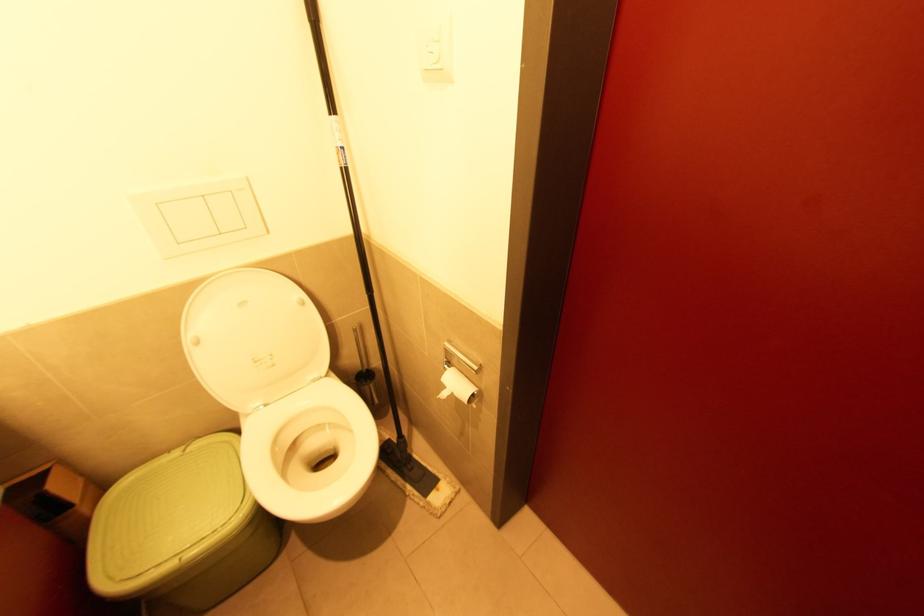
Locate an element on the screen. The height and width of the screenshot is (616, 924). white toilet seat is located at coordinates tap(310, 452).